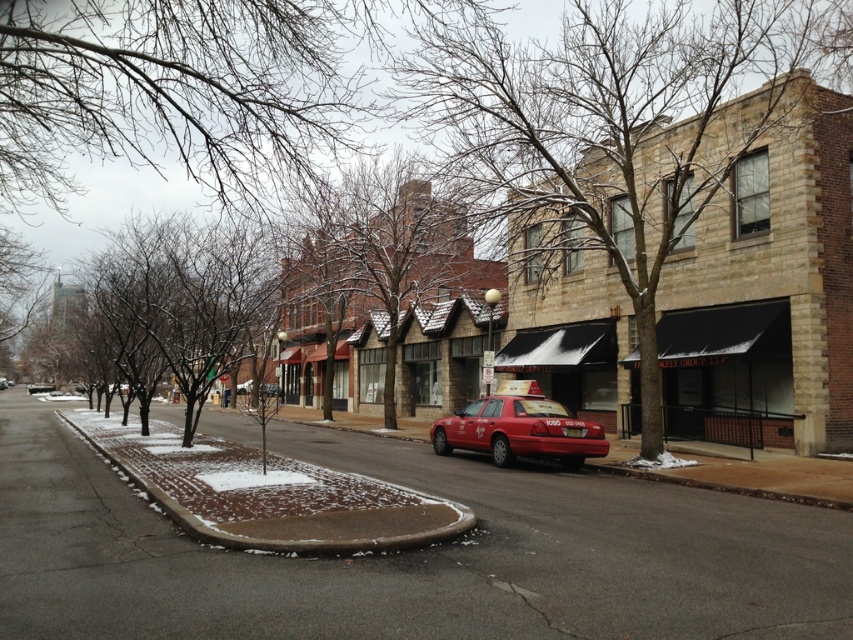
In the scene shown: You are standing at the point labeled point (39, 387) in the image. Looking around, you see a metallic silver taxi at center. Which direction should you face to see the metallic silver taxi at center?

A: The point labeled point (39, 387) is the location of the metallic silver taxi at center, so you are already facing it.

You are a pedestrian standing on the sidewalk and see both the shiny red taxi at center and the red matte taxi at center in the street. Which taxi is closer to the right side of the road?

The shiny red taxi at center is positioned on the right side of the red matte taxi at center, so it is closer to the right side of the road.